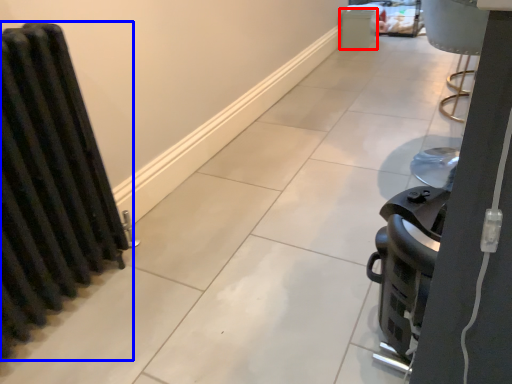
Question: Which object appears farthest to the camera in this image, appliance (highlighted by a red box) or radiator (highlighted by a blue box)?

Choices:
 (A) appliance
 (B) radiator

Answer: (A)